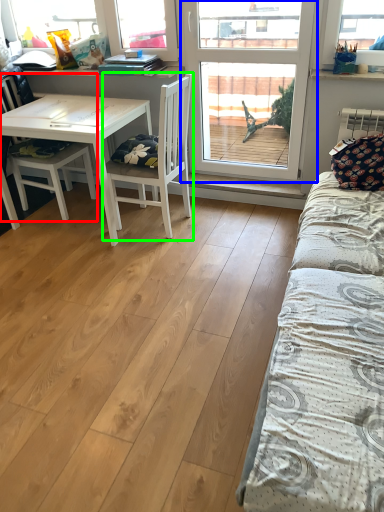
Question: Estimate the real-world distances between objects in this image. Which object is farther from chair (highlighted by a red box), window (highlighted by a blue box) or chair (highlighted by a green box)?

Choices:
 (A) window
 (B) chair

Answer: (A)